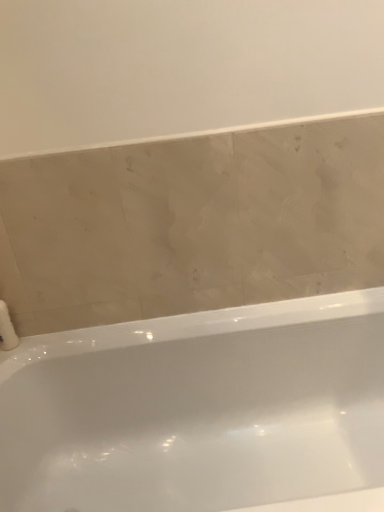
Measure the distance between white glossy bathtub at center and camera.

white glossy bathtub at center is 1.13 meters from camera.

What do you see at coordinates (200, 411) in the screenshot? I see `white glossy bathtub at center` at bounding box center [200, 411].

Find the location of a particular element. The height and width of the screenshot is (512, 384). white glossy bathtub at center is located at coordinates pos(200,411).

This screenshot has height=512, width=384. What do you see at coordinates (7, 329) in the screenshot?
I see `white fluffy toilet paper at lower left` at bounding box center [7, 329].

What are the coordinates of `white fluffy toilet paper at lower left` in the screenshot? It's located at (7, 329).

You are a GUI agent. You are given a task and a screenshot of the screen. Output one action in this format:
    pyautogui.click(x=<x>, y=<y>)
    Task: Click on the white glossy bathtub at center
    The image size is (384, 512).
    Given the screenshot: What is the action you would take?
    pyautogui.click(x=200, y=411)

Considering the positions of objects white fluffy toilet paper at lower left and white glossy bathtub at center in the image provided, who is more to the right, white fluffy toilet paper at lower left or white glossy bathtub at center?

white glossy bathtub at center is more to the right.

Consider the image. Which object is more forward, white fluffy toilet paper at lower left or white glossy bathtub at center?

white glossy bathtub at center.

Is point (6, 325) closer or farther from the camera than point (134, 451)?

Clearly, point (6, 325) is closer to the camera than point (134, 451).

From the image's perspective, is white fluffy toilet paper at lower left located beneath white glossy bathtub at center?

No, from the image's perspective, white fluffy toilet paper at lower left is not beneath white glossy bathtub at center.

Based on the photo, from a real-world perspective, between white fluffy toilet paper at lower left and white glossy bathtub at center, who is vertically higher?

white fluffy toilet paper at lower left is physically above.

Is white fluffy toilet paper at lower left wider than white glossy bathtub at center?

Incorrect, the width of white fluffy toilet paper at lower left does not surpass that of white glossy bathtub at center.

Who is shorter, white fluffy toilet paper at lower left or white glossy bathtub at center?

white fluffy toilet paper at lower left.

Looking at the image, does white fluffy toilet paper at lower left seem bigger or smaller compared to white glossy bathtub at center?

Considering their sizes, white fluffy toilet paper at lower left takes up less space than white glossy bathtub at center.

Which is correct: white fluffy toilet paper at lower left is inside white glossy bathtub at center, or outside of it?

white fluffy toilet paper at lower left is spatially situated outside white glossy bathtub at center.

Is there a large distance between white fluffy toilet paper at lower left and white glossy bathtub at center?

Actually, white fluffy toilet paper at lower left and white glossy bathtub at center are a little close together.

Is white fluffy toilet paper at lower left aimed at white glossy bathtub at center?

No.

The width and height of the screenshot is (384, 512). I want to click on toilet paper on the left of white glossy bathtub at center, so (7, 329).

Which is more to the left, white glossy bathtub at center or white fluffy toilet paper at lower left?

white fluffy toilet paper at lower left.

Is white glossy bathtub at center further to camera compared to white fluffy toilet paper at lower left?

No.

Is point (338, 417) positioned behind point (12, 334)?

Yes.

From the image's perspective, relative to white fluffy toilet paper at lower left, is white glossy bathtub at center above or below?

white glossy bathtub at center is below white fluffy toilet paper at lower left.

From a real-world perspective, is white glossy bathtub at center over white fluffy toilet paper at lower left?

No, from a real-world perspective, white glossy bathtub at center is not on top of white fluffy toilet paper at lower left.

Considering the sizes of objects white glossy bathtub at center and white fluffy toilet paper at lower left in the image provided, who is wider, white glossy bathtub at center or white fluffy toilet paper at lower left?

white glossy bathtub at center.

Can you confirm if white glossy bathtub at center is shorter than white fluffy toilet paper at lower left?

In fact, white glossy bathtub at center may be taller than white fluffy toilet paper at lower left.

Can you confirm if white glossy bathtub at center is smaller than white fluffy toilet paper at lower left?

Incorrect, white glossy bathtub at center is not smaller in size than white fluffy toilet paper at lower left.

Would you say white glossy bathtub at center contains white fluffy toilet paper at lower left?

No, white fluffy toilet paper at lower left is not inside white glossy bathtub at center.

From the picture: Can you see white glossy bathtub at center touching white fluffy toilet paper at lower left?

No.

Is white glossy bathtub at center aimed at white fluffy toilet paper at lower left?

No, white glossy bathtub at center is not aimed at white fluffy toilet paper at lower left.

Can you tell me how much white glossy bathtub at center and white fluffy toilet paper at lower left differ in facing direction?

The angle between the facing direction of white glossy bathtub at center and the facing direction of white fluffy toilet paper at lower left is 4.19 degrees.

Where is `bathtub below the white fluffy toilet paper at lower left (from the image's perspective)`? The width and height of the screenshot is (384, 512). bathtub below the white fluffy toilet paper at lower left (from the image's perspective) is located at coordinates (200, 411).

Find the location of a particular element. toilet paper above the white glossy bathtub at center (from the image's perspective) is located at coordinates (7, 329).

Locate an element on the screen. The width and height of the screenshot is (384, 512). bathtub in front of the white fluffy toilet paper at lower left is located at coordinates (200, 411).